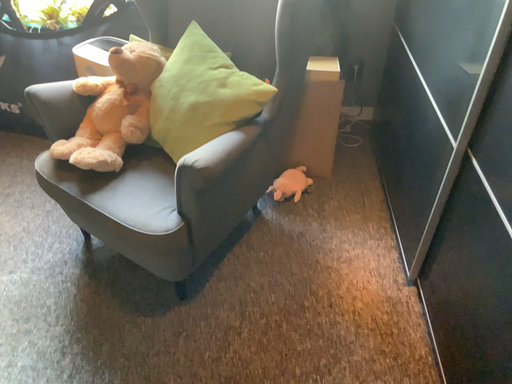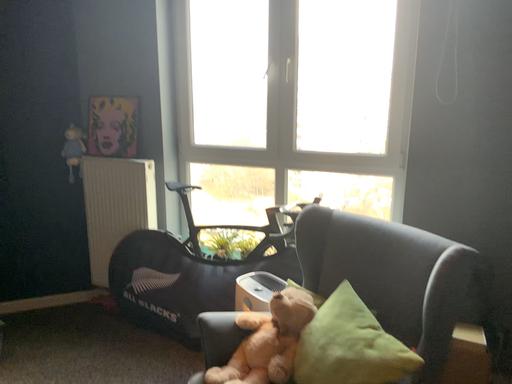
Question: How did the camera likely rotate when shooting the video?

Choices:
 (A) rotated left
 (B) rotated right

Answer: (A)